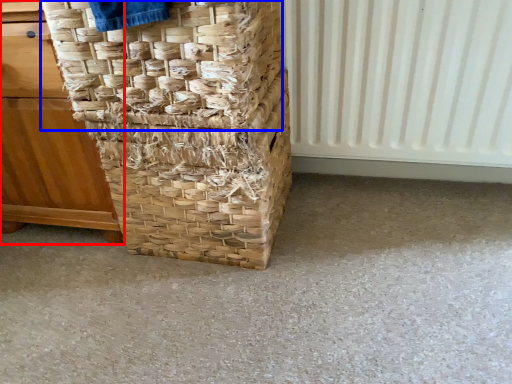
Question: Which object appears farthest to the camera in this image, furniture (highlighted by a red box) or basket (highlighted by a blue box)?

Choices:
 (A) furniture
 (B) basket

Answer: (A)